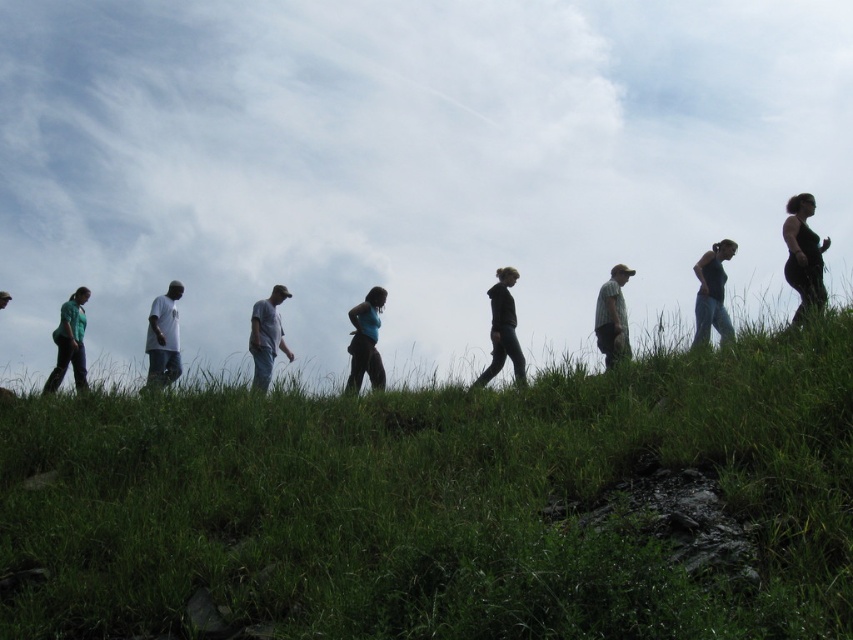
Question: Is black matte dress at right wider than black matte tank top at right?

Choices:
 (A) yes
 (B) no

Answer: (A)

Question: Can you confirm if black matte tank top at right is positioned to the left of white cotton shirt at left?

Choices:
 (A) no
 (B) yes

Answer: (A)

Question: Which point is closer to the camera?

Choices:
 (A) (703, 344)
 (B) (7, 388)
 (C) (372, 356)

Answer: (A)

Question: Which is nearer to the blue fabric pants at center?

Choices:
 (A) matte green shirt at center
 (B) green fabric shirt at left
 (C) black matte dress at right

Answer: (A)

Question: Is black matte dress at right to the right of light gray cotton shirt at center from the viewer's perspective?

Choices:
 (A) no
 (B) yes

Answer: (B)

Question: Which point is farther to the camera?

Choices:
 (A) white cotton shirt at left
 (B) light gray cotton shirt at center

Answer: (B)